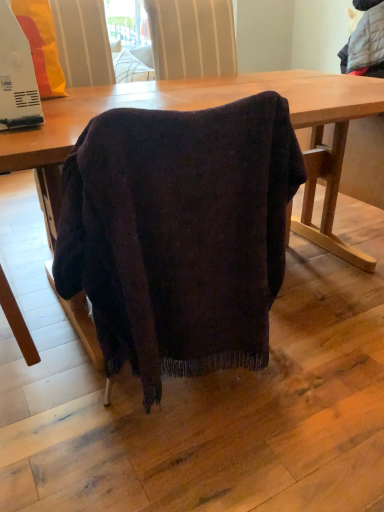
Question: Is white plastic microwave at upper left in front of or behind dark wood table at center in the image?

Choices:
 (A) front
 (B) behind

Answer: (B)

Question: From the image's perspective, is white plastic microwave at upper left located above or below dark wood table at center?

Choices:
 (A) above
 (B) below

Answer: (A)

Question: Would you say white plastic microwave at upper left is to the left or to the right of dark wood table at center in the picture?

Choices:
 (A) right
 (B) left

Answer: (B)

Question: From the image's perspective, relative to white plastic microwave at upper left, is dark wood table at center above or below?

Choices:
 (A) above
 (B) below

Answer: (B)

Question: Is dark wood table at center taller or shorter than white plastic microwave at upper left?

Choices:
 (A) tall
 (B) short

Answer: (A)

Question: From a real-world perspective, is dark wood table at center positioned above or below white plastic microwave at upper left?

Choices:
 (A) below
 (B) above

Answer: (A)

Question: Relative to white plastic microwave at upper left, is dark wood table at center in front or behind?

Choices:
 (A) front
 (B) behind

Answer: (A)